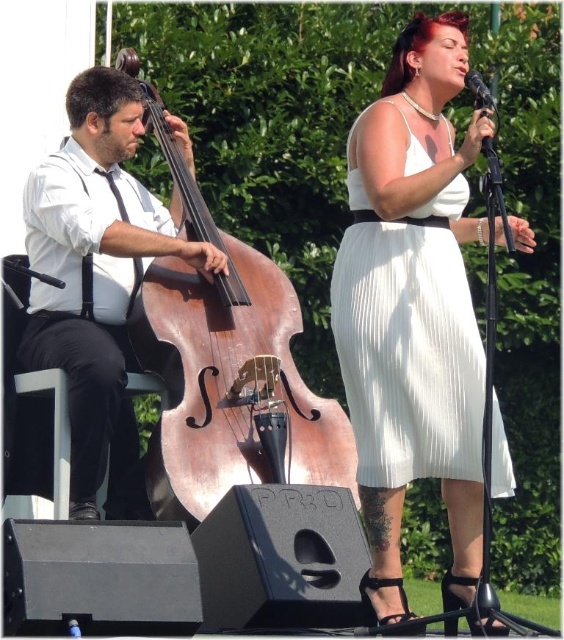
Question: Is brown wooden cello at center bigger than black matte microphone at upper right?

Choices:
 (A) no
 (B) yes

Answer: (A)

Question: Which object is farther from the camera taking this photo?

Choices:
 (A) white pleated dress at center
 (B) black matte microphone at upper right

Answer: (A)

Question: Is matte black double bass at left wider than white pleated dress at center?

Choices:
 (A) no
 (B) yes

Answer: (B)

Question: Which point is closer to the camera taking this photo?

Choices:
 (A) (367, 381)
 (B) (89, 360)
 (C) (468, 84)

Answer: (C)

Question: Among these points, which one is nearest to the camera?

Choices:
 (A) (253, 252)
 (B) (104, 336)

Answer: (B)

Question: Observing the image, what is the correct spatial positioning of brown wooden cello at center in reference to matte black double bass at left?

Choices:
 (A) above
 (B) below

Answer: (B)